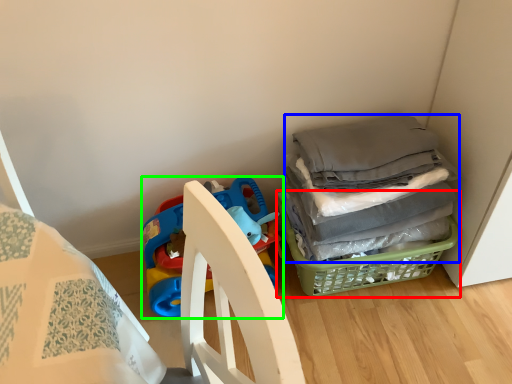
Question: Based on their relative distances, which object is farther from basket (highlighted by a red box)? Choose from clothing (highlighted by a blue box) and toy (highlighted by a green box).

Choices:
 (A) clothing
 (B) toy

Answer: (B)